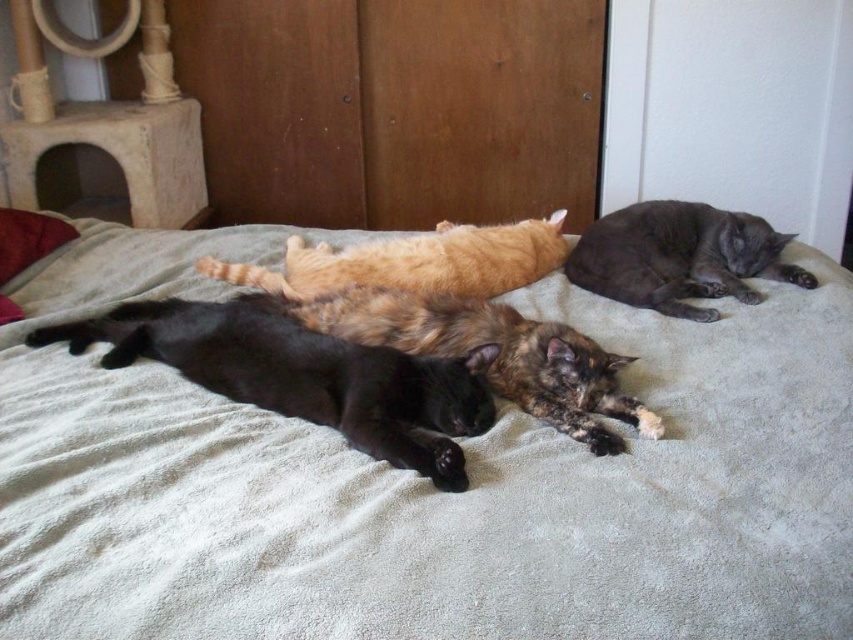
You are a photographer trying to capture a group photo of the shiny gray cat at upper right and the orange fur cat at center. If you want to ensure both cats are in focus, which cat should you focus on first considering their heights?

The shiny gray cat at upper right is taller than the orange fur cat at center, so you should focus on the shiny gray cat at upper right first to ensure both are in focus.